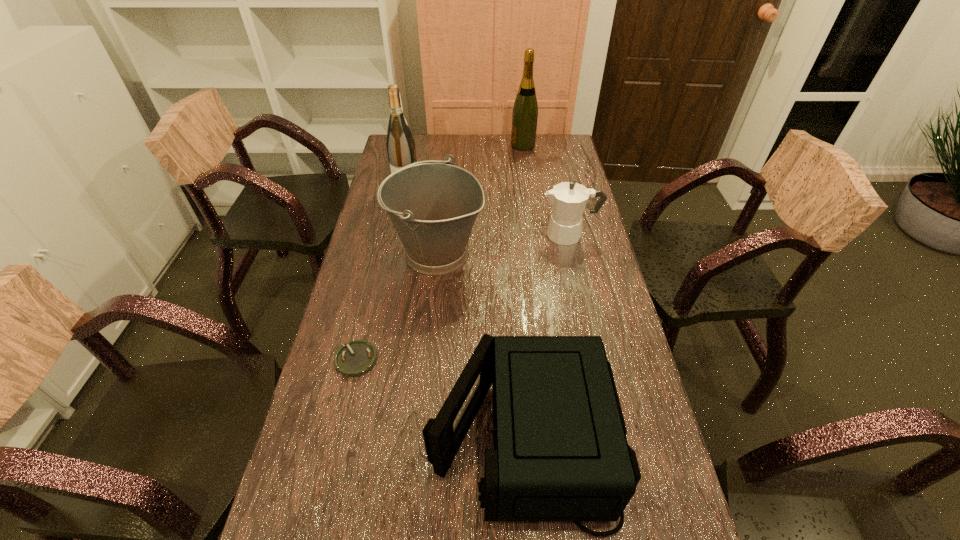
In the image, there is a desktop. Where is `free space at the right edge`? This screenshot has height=540, width=960. free space at the right edge is located at coordinates (549, 173).

The image size is (960, 540). What are the coordinates of `vacant space at the far right corner` in the screenshot? It's located at 544,153.

The width and height of the screenshot is (960, 540). I want to click on free spot between the coffeepot and the microwave oven, so click(x=546, y=334).

In order to click on vacant area between the bucket and the shortest object in this screenshot , I will do `click(396, 307)`.

Find the location of a particular element. vacant space that is in between the microwave oven and the coffeepot is located at coordinates (546, 334).

Find the location of a particular element. The image size is (960, 540). empty space between the bucket and the coffeepot is located at coordinates (503, 244).

I want to click on object that stands as the fifth closest to the nearer wine bottle, so click(560, 454).

Where is `the third closest object relative to the coffeepot`? the third closest object relative to the coffeepot is located at coordinates (400, 144).

Where is `vacant region that satisfies the following two spatial constraints: 1. on the front-facing side of the farthest object; 2. on the front side of the bucket`? The height and width of the screenshot is (540, 960). vacant region that satisfies the following two spatial constraints: 1. on the front-facing side of the farthest object; 2. on the front side of the bucket is located at coordinates (538, 253).

This screenshot has width=960, height=540. I want to click on free space that satisfies the following two spatial constraints: 1. on the back side of the fifth nearest object; 2. on the left side of the shortest object, so click(397, 186).